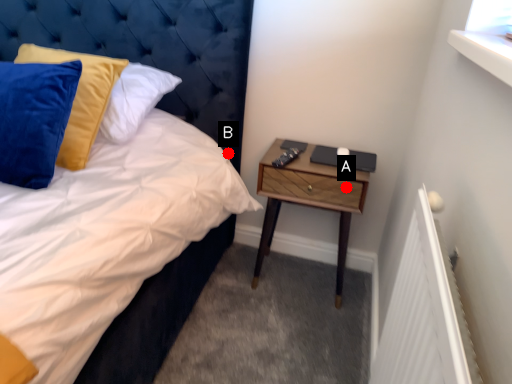
Question: Two points are circled on the image, labeled by A and B beside each circle. Which point is closer to the camera?

Choices:
 (A) A is closer
 (B) B is closer

Answer: (A)